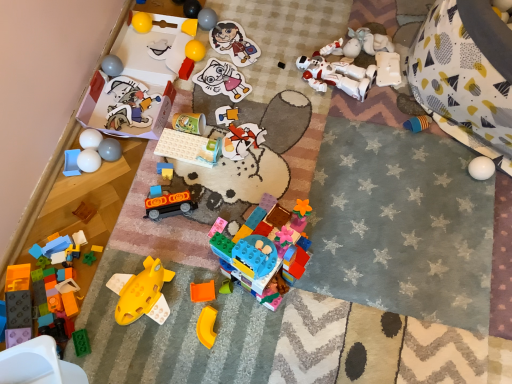
The width and height of the screenshot is (512, 384). In order to click on free space between matte paper sticker at center, the eighteenth toy positioned from the left, and yellow matte plastic piece at center, the seventeenth toy viewed from the left in this screenshot , I will do `click(218, 180)`.